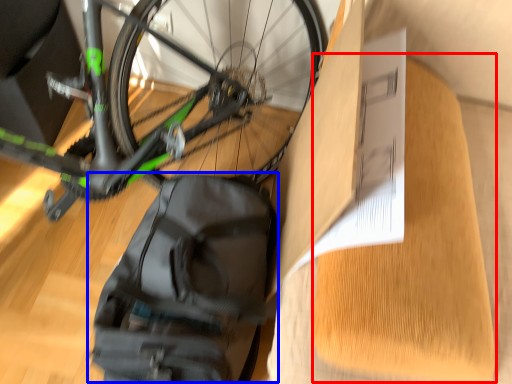
Question: Which object is closer to the camera taking this photo, cardboard (highlighted by a red box) or backpack (highlighted by a blue box)?

Choices:
 (A) cardboard
 (B) backpack

Answer: (A)